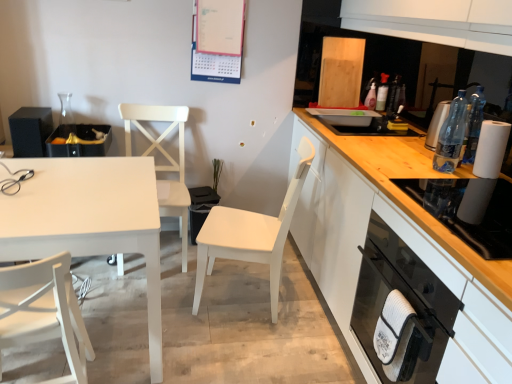
This screenshot has height=384, width=512. Find the location of `free space in front of clear plastic bottle at right, the second bottle in the top-to-bottom sequence`. free space in front of clear plastic bottle at right, the second bottle in the top-to-bottom sequence is located at coordinates (445, 178).